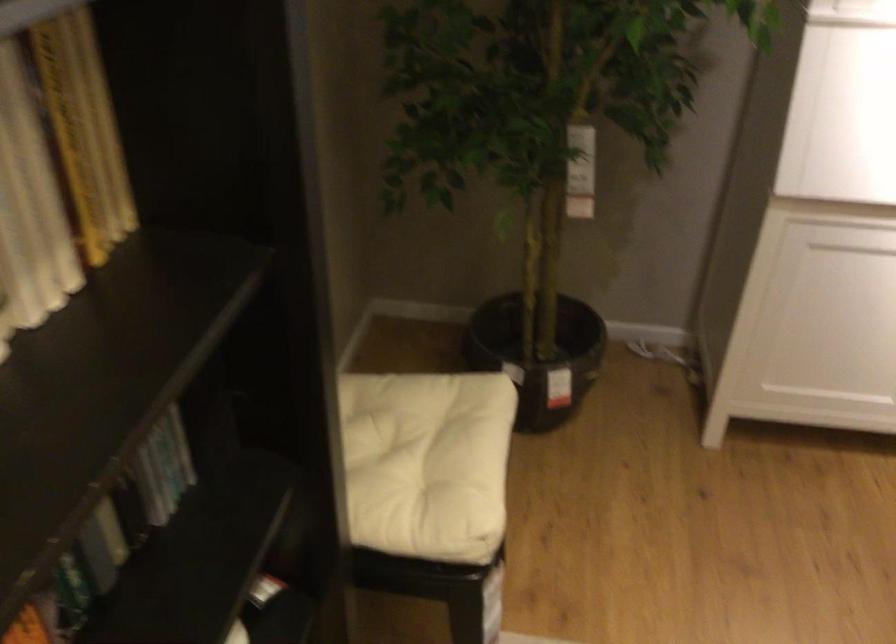
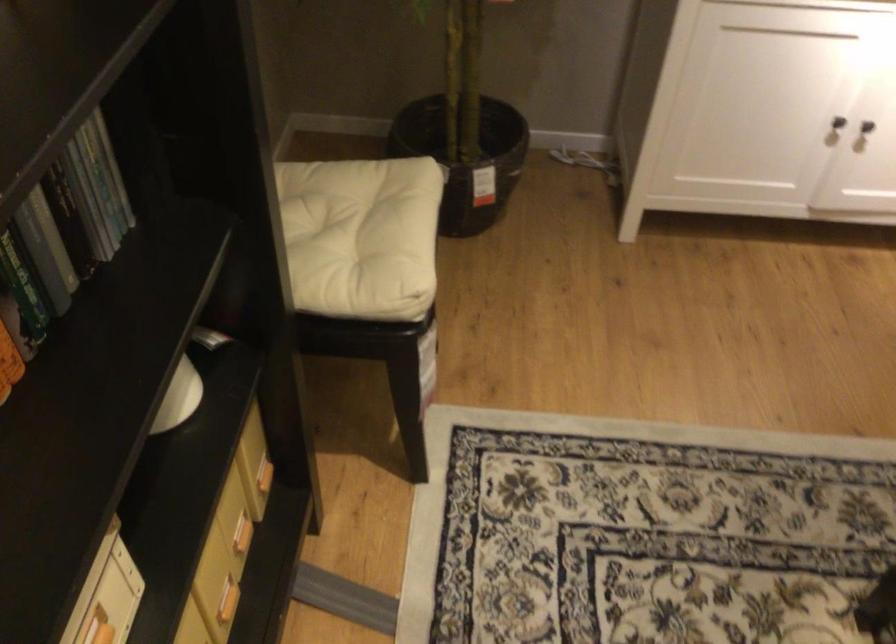
The point at (424, 457) is marked in the first image. Where is the corresponding point in the second image?

(355, 234)